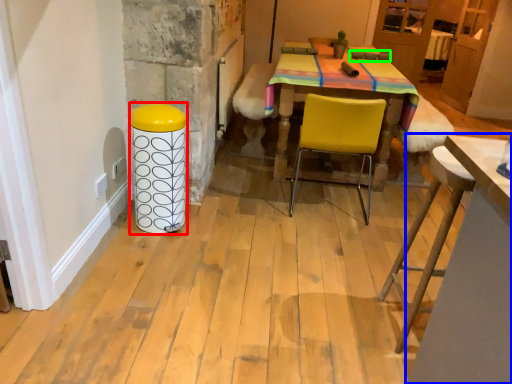
Question: Which object is the closest to the bar stool (highlighted by a red box)? Choose among these: table (highlighted by a blue box) or armchair (highlighted by a green box).

Choices:
 (A) table
 (B) armchair

Answer: (A)